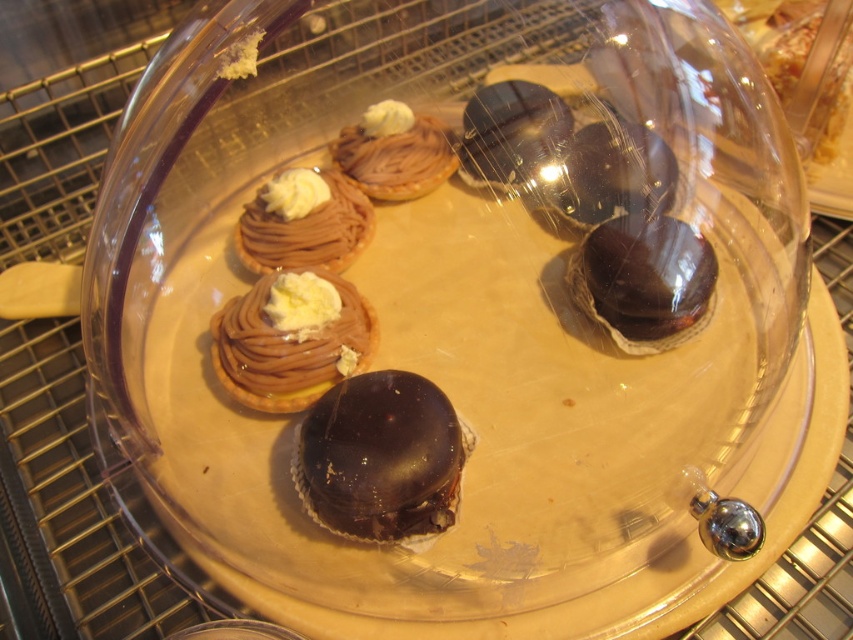
You are a customer at a bakery and want to choose the bigger pastry between the chocolate cream tart at center and the shiny chocolate truffle at upper center. Which one should you pick?

The chocolate cream tart at center is larger in size than the shiny chocolate truffle at upper center, so you should pick the chocolate cream tart at center.

You are a customer at the bakery and want to point out the shiny dark chocolate truffle at center to the cashier. If the cashier asks for its exact location, what coordinates would you provide?

The shiny dark chocolate truffle at center is located at coordinates (643, 276).

You are a customer at the bakery and want to take a photo of the pastries under the glass dome. You notice two points marked on the dome at coordinates point (x=247, y=310) and point (x=477, y=156). Which point should you focus on to ensure the closest pastry is in sharp focus?

Point (x=247, y=310) is further to the camera than point (x=477, y=156). Therefore, focusing on point (x=247, y=310) will ensure the closest pastry is in sharp focus.